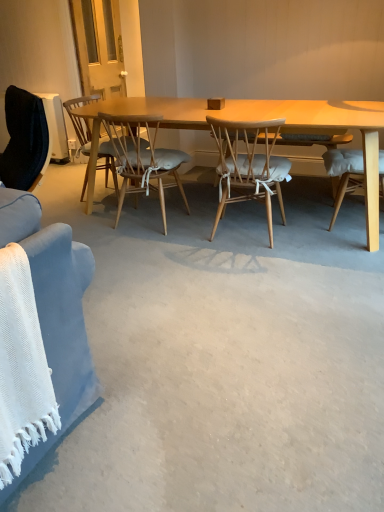
Locate an element on the screen. light brown woven wood chair at center, the first chair positioned from the right is located at coordinates (248, 166).

This screenshot has width=384, height=512. Find the location of `wooden chair with cushion at center, acting as the 3th chair starting from the right`. wooden chair with cushion at center, acting as the 3th chair starting from the right is located at coordinates (81, 121).

Where is `light brown wood chair at center, which ranks as the 2th chair in left-to-right order`? This screenshot has height=512, width=384. light brown wood chair at center, which ranks as the 2th chair in left-to-right order is located at coordinates (142, 157).

Where is `light brown woven wood chair at center, the first chair positioned from the right`? light brown woven wood chair at center, the first chair positioned from the right is located at coordinates (248, 166).

Is light brown woven wood chair at center, the first chair positioned from the right, touching wooden chair with cushion at center, acting as the 3th chair starting from the right?

light brown woven wood chair at center, the first chair positioned from the right, is not next to wooden chair with cushion at center, acting as the 3th chair starting from the right, and they're not touching.

From a real-world perspective, is light brown woven wood chair at center, placed as the 3th chair when sorted from left to right, beneath wooden chair with cushion at center, acting as the 3th chair starting from the right?

Yes, from a real-world perspective, light brown woven wood chair at center, placed as the 3th chair when sorted from left to right, is beneath wooden chair with cushion at center, acting as the 3th chair starting from the right.

From the image's perspective, would you say light brown woven wood chair at center, placed as the 3th chair when sorted from left to right, is shown under wooden chair with cushion at center, which ranks as the 1th chair in left-to-right order?

Yes.

In the scene shown: Considering the positions of objects light brown wood chair at center, the second chair in the right-to-left sequence, and light brown woven wood chair at center, the first chair positioned from the right, in the image provided, who is behind, light brown wood chair at center, the second chair in the right-to-left sequence, or light brown woven wood chair at center, the first chair positioned from the right,?

Positioned behind is light brown wood chair at center, the second chair in the right-to-left sequence.

From a real-world perspective, is light brown wood chair at center, which ranks as the 2th chair in left-to-right order, physically above light brown woven wood chair at center, the first chair positioned from the right?

Actually, light brown wood chair at center, which ranks as the 2th chair in left-to-right order, is physically below light brown woven wood chair at center, the first chair positioned from the right, in the real world.

Would you consider light brown wood chair at center, the second chair in the right-to-left sequence, to be distant from light brown woven wood chair at center, placed as the 3th chair when sorted from left to right?

light brown wood chair at center, the second chair in the right-to-left sequence, is actually quite close to light brown woven wood chair at center, placed as the 3th chair when sorted from left to right.

Would you say light brown wood chair at center, the second chair in the right-to-left sequence, is inside or outside light brown woven wood chair at center, the first chair positioned from the right?

light brown wood chair at center, the second chair in the right-to-left sequence, is outside light brown woven wood chair at center, the first chair positioned from the right.

Is light brown woven wood chair at center, the first chair positioned from the right, in front of or behind light brown wood chair at center, the second chair in the right-to-left sequence, in the image?

light brown woven wood chair at center, the first chair positioned from the right, is positioned closer to the viewer than light brown wood chair at center, the second chair in the right-to-left sequence.

From the image's perspective, which object appears higher, light brown woven wood chair at center, the first chair positioned from the right, or light brown wood chair at center, the second chair in the right-to-left sequence?

light brown wood chair at center, the second chair in the right-to-left sequence, from the image's perspective.

Is light brown woven wood chair at center, placed as the 3th chair when sorted from left to right, oriented away from light brown wood chair at center, which ranks as the 2th chair in left-to-right order?

No, light brown woven wood chair at center, placed as the 3th chair when sorted from left to right, is not facing the opposite direction of light brown wood chair at center, which ranks as the 2th chair in left-to-right order.

Considering the sizes of light brown woven wood chair at center, the first chair positioned from the right, and light brown wood chair at center, the second chair in the right-to-left sequence, in the image, is light brown woven wood chair at center, the first chair positioned from the right, taller or shorter than light brown wood chair at center, the second chair in the right-to-left sequence,?

Considering their sizes, light brown woven wood chair at center, the first chair positioned from the right, has less height than light brown wood chair at center, the second chair in the right-to-left sequence.

Consider the image. Considering the sizes of objects wooden chair with cushion at center, acting as the 3th chair starting from the right, and light brown woven wood chair at center, the first chair positioned from the right, in the image provided, who is thinner, wooden chair with cushion at center, acting as the 3th chair starting from the right, or light brown woven wood chair at center, the first chair positioned from the right,?

With smaller width is wooden chair with cushion at center, acting as the 3th chair starting from the right.

Which object is positioned more to the right, wooden chair with cushion at center, acting as the 3th chair starting from the right, or light brown woven wood chair at center, the first chair positioned from the right?

light brown woven wood chair at center, the first chair positioned from the right, is more to the right.

What's the angular difference between wooden chair with cushion at center, acting as the 3th chair starting from the right, and light brown woven wood chair at center, the first chair positioned from the right,'s facing directions?

90 degrees separate the facing orientations of wooden chair with cushion at center, acting as the 3th chair starting from the right, and light brown woven wood chair at center, the first chair positioned from the right.

Is light brown wood chair at center, which ranks as the 2th chair in left-to-right order, aimed at wooden chair with cushion at center, acting as the 3th chair starting from the right?

No, light brown wood chair at center, which ranks as the 2th chair in left-to-right order, is not turned towards wooden chair with cushion at center, acting as the 3th chair starting from the right.

From the picture: How distant is light brown wood chair at center, the second chair in the right-to-left sequence, from wooden chair with cushion at center, which ranks as the 1th chair in left-to-right order?

light brown wood chair at center, the second chair in the right-to-left sequence, and wooden chair with cushion at center, which ranks as the 1th chair in left-to-right order, are 10.50 inches apart from each other.

Is light brown wood chair at center, which ranks as the 2th chair in left-to-right order, in front of or behind wooden chair with cushion at center, acting as the 3th chair starting from the right, in the image?

Clearly, light brown wood chair at center, which ranks as the 2th chair in left-to-right order, is in front of wooden chair with cushion at center, acting as the 3th chair starting from the right.

Which is in front, point (113, 125) or point (84, 118)?

The point (113, 125) is closer to the camera.

Looking at their sizes, would you say wooden chair with cushion at center, acting as the 3th chair starting from the right, is wider or thinner than light brown wood chair at center, which ranks as the 2th chair in left-to-right order?

wooden chair with cushion at center, acting as the 3th chair starting from the right, is wider than light brown wood chair at center, which ranks as the 2th chair in left-to-right order.

In the scene shown: Is wooden chair with cushion at center, which ranks as the 1th chair in left-to-right order, oriented towards light brown wood chair at center, which ranks as the 2th chair in left-to-right order?

No, wooden chair with cushion at center, which ranks as the 1th chair in left-to-right order, does not turn towards light brown wood chair at center, which ranks as the 2th chair in left-to-right order.

Considering the positions of point (84, 125) and point (123, 153), is point (84, 125) closer or farther from the camera than point (123, 153)?

Point (84, 125) appears to be farther away from the viewer than point (123, 153).

Which object is closer to the camera, wooden chair with cushion at center, acting as the 3th chair starting from the right, or light brown wood chair at center, the second chair in the right-to-left sequence?

light brown wood chair at center, the second chair in the right-to-left sequence, is in front.

From the wooden chair with cushion at center, which ranks as the 1th chair in left-to-right order, count 2nd chairs forward and point to it. Please provide its 2D coordinates.

[(248, 166)]

Where is `the 1st chair to the left when counting from the light brown woven wood chair at center, placed as the 3th chair when sorted from left to right`? The image size is (384, 512). the 1st chair to the left when counting from the light brown woven wood chair at center, placed as the 3th chair when sorted from left to right is located at coordinates (142, 157).

When comparing their distances from light brown woven wood chair at center, the first chair positioned from the right, does wooden chair with cushion at center, acting as the 3th chair starting from the right, or light brown wood chair at center, the second chair in the right-to-left sequence, seem further?

Among the two, wooden chair with cushion at center, acting as the 3th chair starting from the right, is located further to light brown woven wood chair at center, the first chair positioned from the right.

From the picture: Estimate the real-world distances between objects in this image. Which object is further from wooden chair with cushion at center, acting as the 3th chair starting from the right, light brown wood chair at center, the second chair in the right-to-left sequence, or light brown woven wood chair at center, placed as the 3th chair when sorted from left to right?

Among the two, light brown woven wood chair at center, placed as the 3th chair when sorted from left to right, is located further to wooden chair with cushion at center, acting as the 3th chair starting from the right.

Considering their positions, is light brown woven wood chair at center, placed as the 3th chair when sorted from left to right, positioned further to wooden chair with cushion at center, acting as the 3th chair starting from the right, than light brown wood chair at center, the second chair in the right-to-left sequence?

Among the two, light brown woven wood chair at center, placed as the 3th chair when sorted from left to right, is located further to wooden chair with cushion at center, acting as the 3th chair starting from the right.

Based on their spatial positions, is light brown woven wood chair at center, the first chair positioned from the right, or wooden chair with cushion at center, which ranks as the 1th chair in left-to-right order, closer to light brown wood chair at center, the second chair in the right-to-left sequence?

wooden chair with cushion at center, which ranks as the 1th chair in left-to-right order, is closer to light brown wood chair at center, the second chair in the right-to-left sequence.

When comparing their distances from light brown woven wood chair at center, placed as the 3th chair when sorted from left to right, does light brown wood chair at center, which ranks as the 2th chair in left-to-right order, or wooden chair with cushion at center, which ranks as the 1th chair in left-to-right order, seem closer?

light brown wood chair at center, which ranks as the 2th chair in left-to-right order, lies closer to light brown woven wood chair at center, placed as the 3th chair when sorted from left to right, than the other object.

Estimate the real-world distances between objects in this image. Which object is closer to light brown wood chair at center, the second chair in the right-to-left sequence, wooden chair with cushion at center, which ranks as the 1th chair in left-to-right order, or light brown woven wood chair at center, the first chair positioned from the right?

Based on the image, wooden chair with cushion at center, which ranks as the 1th chair in left-to-right order, appears to be nearer to light brown wood chair at center, the second chair in the right-to-left sequence.

This screenshot has height=512, width=384. Identify the location of chair located between wooden chair with cushion at center, which ranks as the 1th chair in left-to-right order, and light brown woven wood chair at center, the first chair positioned from the right, in the left-right direction. (142, 157).